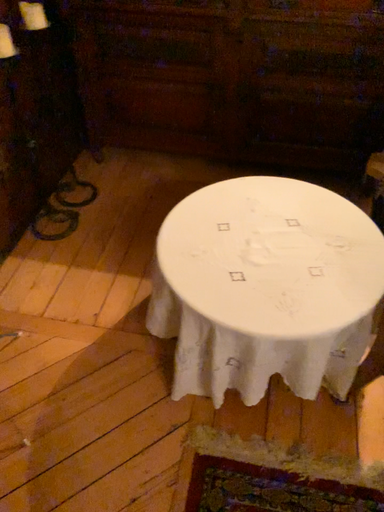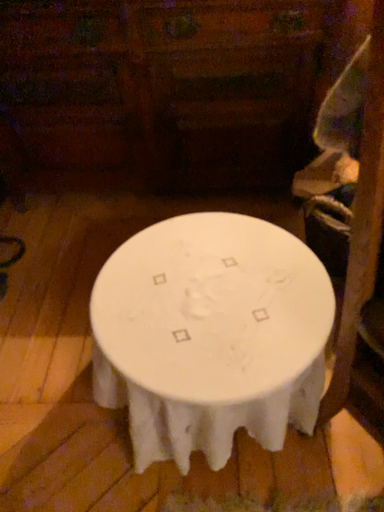
Question: How did the camera likely rotate when shooting the video?

Choices:
 (A) rotated right
 (B) rotated left

Answer: (A)